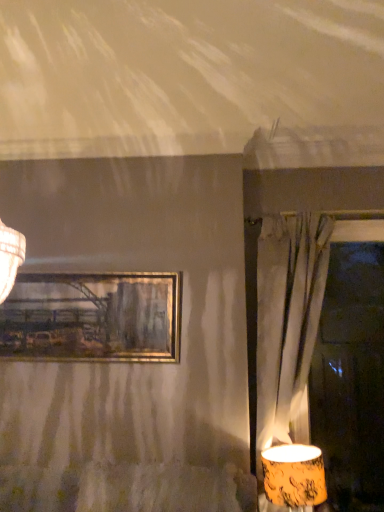
You are a GUI agent. You are given a task and a screenshot of the screen. Output one action in this format:
    pyautogui.click(x=<x>, y=<y>)
    Task: Click on the gold metallic picture frame at upper center
    
    Given the screenshot: What is the action you would take?
    pyautogui.click(x=92, y=317)

Who is smaller, matte orange lampshade at lower right or gold metallic picture frame at upper center?

gold metallic picture frame at upper center is smaller.

From the image's perspective, is matte orange lampshade at lower right below gold metallic picture frame at upper center?

Yes.

Which of these two, matte orange lampshade at lower right or gold metallic picture frame at upper center, is thinner?

gold metallic picture frame at upper center.

Is the depth of matte orange lampshade at lower right greater than that of gold metallic picture frame at upper center?

No.

Consider the image. Could you tell me if gold metallic picture frame at upper center is facing matte orange lampshade at lower right?

No, gold metallic picture frame at upper center is not facing towards matte orange lampshade at lower right.

Is gold metallic picture frame at upper center behind matte orange lampshade at lower right?

Yes, it is.

Can you confirm if gold metallic picture frame at upper center is taller than matte orange lampshade at lower right?

Yes.

Is gold metallic picture frame at upper center spatially inside matte gray curtain at right, or outside of it?

gold metallic picture frame at upper center is not enclosed by matte gray curtain at right.

Considering the sizes of objects gold metallic picture frame at upper center and matte gray curtain at right in the image provided, who is thinner, gold metallic picture frame at upper center or matte gray curtain at right?

gold metallic picture frame at upper center is thinner.

Does gold metallic picture frame at upper center touch matte gray curtain at right?

gold metallic picture frame at upper center and matte gray curtain at right are not in contact.

From the image's perspective, is matte gray curtain at right located beneath matte orange lampshade at lower right?

Incorrect, from the image's perspective, matte gray curtain at right is higher than matte orange lampshade at lower right.

Which of these two, matte gray curtain at right or matte orange lampshade at lower right, is wider?

With larger width is matte orange lampshade at lower right.

Which object is positioned more to the right, matte gray curtain at right or matte orange lampshade at lower right?

matte gray curtain at right is more to the right.

Does matte gray curtain at right turn towards matte orange lampshade at lower right?

Yes, matte gray curtain at right is facing matte orange lampshade at lower right.

Which object is closer to the camera taking this photo, matte orange lampshade at lower right or matte gray curtain at right?

matte orange lampshade at lower right is closer to the camera.

Is matte orange lampshade at lower right at the right side of matte gray curtain at right?

In fact, matte orange lampshade at lower right is to the left of matte gray curtain at right.

Looking at this image, is matte orange lampshade at lower right wider than matte gray curtain at right?

Indeed, matte orange lampshade at lower right has a greater width compared to matte gray curtain at right.

Does matte gray curtain at right come in front of gold metallic picture frame at upper center?

Yes, the depth of matte gray curtain at right is less than that of gold metallic picture frame at upper center.

Considering the sizes of objects matte gray curtain at right and gold metallic picture frame at upper center in the image provided, who is shorter, matte gray curtain at right or gold metallic picture frame at upper center?

gold metallic picture frame at upper center.

From a real-world perspective, between matte gray curtain at right and gold metallic picture frame at upper center, who is vertically lower?

matte gray curtain at right.

In the image, there is a gold metallic picture frame at upper center. Identify the location of lamp below it (from a real-world perspective). The width and height of the screenshot is (384, 512). (294, 475).

Where is `picture frame above the matte orange lampshade at lower right (from a real-world perspective)`? This screenshot has width=384, height=512. picture frame above the matte orange lampshade at lower right (from a real-world perspective) is located at coordinates (92, 317).

From the image, which object appears to be nearer to gold metallic picture frame at upper center, matte gray curtain at right or matte orange lampshade at lower right?

The object closer to gold metallic picture frame at upper center is matte gray curtain at right.

Looking at the image, which one is located further to matte gray curtain at right, matte orange lampshade at lower right or gold metallic picture frame at upper center?

Based on the image, gold metallic picture frame at upper center appears to be further to matte gray curtain at right.

Estimate the real-world distances between objects in this image. Which object is further from gold metallic picture frame at upper center, matte orange lampshade at lower right or matte gray curtain at right?

The object further to gold metallic picture frame at upper center is matte orange lampshade at lower right.

Estimate the real-world distances between objects in this image. Which object is further from matte gray curtain at right, gold metallic picture frame at upper center or matte orange lampshade at lower right?

gold metallic picture frame at upper center lies further to matte gray curtain at right than the other object.

When comparing their distances from matte orange lampshade at lower right, does matte gray curtain at right or gold metallic picture frame at upper center seem closer?

The object closer to matte orange lampshade at lower right is matte gray curtain at right.

Considering their positions, is gold metallic picture frame at upper center positioned further to matte orange lampshade at lower right than matte gray curtain at right?

Based on the image, gold metallic picture frame at upper center appears to be further to matte orange lampshade at lower right.

This screenshot has width=384, height=512. In order to click on lamp located between gold metallic picture frame at upper center and matte gray curtain at right in the left-right direction in this screenshot , I will do `click(294, 475)`.